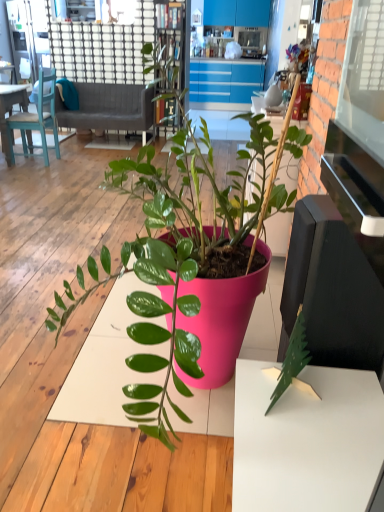
Identify the location of matte pink pot at center. This screenshot has height=512, width=384. (198, 262).

From a real-world perspective, is wooden bookshelf at upper center on matte plastic figurine at upper center?

No.

The image size is (384, 512). I want to click on bookshelf in front of the matte plastic figurine at upper center, so click(175, 36).

Is wooden bookshelf at upper center aimed at matte plastic figurine at upper center?

No.

Which of these two, wooden bookshelf at upper center or matte plastic figurine at upper center, is thinner?

matte plastic figurine at upper center is thinner.

Does gray fabric couch at upper left come in front of teal wooden chair at upper left?

No, it is not.

Is gray fabric couch at upper left outside of teal wooden chair at upper left?

gray fabric couch at upper left is positioned outside teal wooden chair at upper left.

Is gray fabric couch at upper left positioned with its back to teal wooden chair at upper left?

That's not correct — gray fabric couch at upper left is not looking away from teal wooden chair at upper left.

Who is smaller, matte plastic figurine at upper center or matte pink pot at center?

matte plastic figurine at upper center.

Can you confirm if matte plastic figurine at upper center is positioned to the left of matte pink pot at center?

Incorrect, matte plastic figurine at upper center is not on the left side of matte pink pot at center.

You are a GUI agent. You are given a task and a screenshot of the screen. Output one action in this format:
    pyautogui.click(x=<x>, y=<y>)
    Task: Click on the houseplant located in front of the matte plastic figurine at upper center
    Image resolution: width=384 pixels, height=512 pixels.
    Given the screenshot: What is the action you would take?
    pyautogui.click(x=198, y=262)

How different are the orientations of matte pink pot at center and wooden bookshelf at upper center in degrees?

There is a 90.1-degree angle between the facing directions of matte pink pot at center and wooden bookshelf at upper center.

Based on the photo, from the image's perspective, is matte pink pot at center under wooden bookshelf at upper center?

Correct, matte pink pot at center appears lower than wooden bookshelf at upper center in the image.

Could you tell me if matte pink pot at center is facing wooden bookshelf at upper center?

No, matte pink pot at center is not oriented towards wooden bookshelf at upper center.

How many degrees apart are the facing directions of wooden bookshelf at upper center and matte blue desk at left?

88 degrees separate the facing orientations of wooden bookshelf at upper center and matte blue desk at left.

From the image's perspective, between wooden bookshelf at upper center and matte blue desk at left, who is located below?

From the image's view, matte blue desk at left is below.

From a real-world perspective, is wooden bookshelf at upper center positioned above or below matte blue desk at left?

wooden bookshelf at upper center is above matte blue desk at left.

Considering the relative sizes of teal wooden chair at upper left and matte blue desk at left in the image provided, is teal wooden chair at upper left shorter than matte blue desk at left?

No, teal wooden chair at upper left is not shorter than matte blue desk at left.

Is teal wooden chair at upper left at the left side of matte blue desk at left?

Incorrect, teal wooden chair at upper left is not on the left side of matte blue desk at left.

Considering the relative sizes of teal wooden chair at upper left and matte blue desk at left in the image provided, is teal wooden chair at upper left smaller than matte blue desk at left?

Yes, teal wooden chair at upper left is smaller than matte blue desk at left.

From the image's perspective, does teal wooden chair at upper left appear lower than matte blue desk at left?

No, from the image's perspective, teal wooden chair at upper left is not beneath matte blue desk at left.

Is there a large distance between matte pink pot at center and gray fabric couch at upper left?

matte pink pot at center is positioned a significant distance from gray fabric couch at upper left.

From a real-world perspective, which object stands above the other?

matte pink pot at center, from a real-world perspective.

This screenshot has height=512, width=384. Find the location of `studio couch below the matte pink pot at center (from a real-world perspective)`. studio couch below the matte pink pot at center (from a real-world perspective) is located at coordinates (108, 108).

Locate an element on the screen. bookshelf directly beneath the matte plastic figurine at upper center (from a real-world perspective) is located at coordinates (175, 36).

Where is `studio couch behind the teal wooden chair at upper left`? studio couch behind the teal wooden chair at upper left is located at coordinates (108, 108).

From the image, which object appears to be nearer to matte blue desk at left, matte pink pot at center or teal wooden chair at upper left?

teal wooden chair at upper left is closer to matte blue desk at left.

Considering their positions, is matte pink pot at center positioned further to matte plastic figurine at upper center than gray fabric couch at upper left?

gray fabric couch at upper left is further to matte plastic figurine at upper center.

When comparing their distances from matte pink pot at center, does matte blue desk at left or matte plastic figurine at upper center seem closer?

matte plastic figurine at upper center lies closer to matte pink pot at center than the other object.

Estimate the real-world distances between objects in this image. Which object is further from gray fabric couch at upper left, wooden bookshelf at upper center or matte pink pot at center?

matte pink pot at center is further to gray fabric couch at upper left.

Which object lies nearer to the anchor point gray fabric couch at upper left, matte plastic figurine at upper center or matte blue desk at left?

matte blue desk at left.

Based on the photo, estimate the real-world distances between objects in this image. Which object is closer to matte blue desk at left, matte plastic figurine at upper center or wooden bookshelf at upper center?

Among the two, wooden bookshelf at upper center is located nearer to matte blue desk at left.

Which object lies further to the anchor point matte plastic figurine at upper center, gray fabric couch at upper left or wooden bookshelf at upper center?

The object further to matte plastic figurine at upper center is gray fabric couch at upper left.

Based on their spatial positions, is gray fabric couch at upper left or matte blue desk at left further from teal wooden chair at upper left?

gray fabric couch at upper left is further to teal wooden chair at upper left.

Locate an element on the screen. The height and width of the screenshot is (512, 384). chair situated between matte blue desk at left and wooden bookshelf at upper center from left to right is located at coordinates (37, 120).

Where is `studio couch between teal wooden chair at upper left and matte plastic figurine at upper center in the horizontal direction`? studio couch between teal wooden chair at upper left and matte plastic figurine at upper center in the horizontal direction is located at coordinates (108, 108).

This screenshot has height=512, width=384. What are the coordinates of `desk between matte pink pot at center and gray fabric couch at upper left from front to back` in the screenshot? It's located at (10, 114).

At what (x,y) coordinates should I click in order to perform the action: click on studio couch between teal wooden chair at upper left and wooden bookshelf at upper center in the horizontal direction. Please return your answer as a coordinate pair (x, y). This screenshot has height=512, width=384. Looking at the image, I should click on (108, 108).